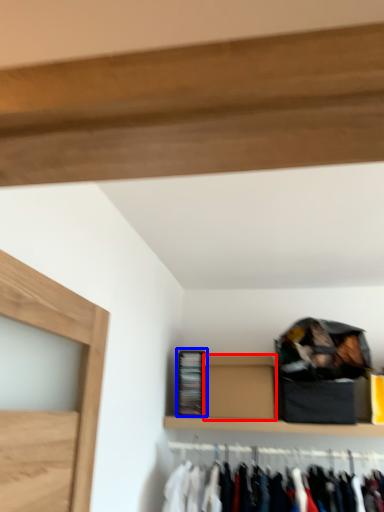
Question: Which object is closer to the camera taking this photo, box (highlighted by a red box) or cabinet (highlighted by a blue box)?

Choices:
 (A) box
 (B) cabinet

Answer: (A)